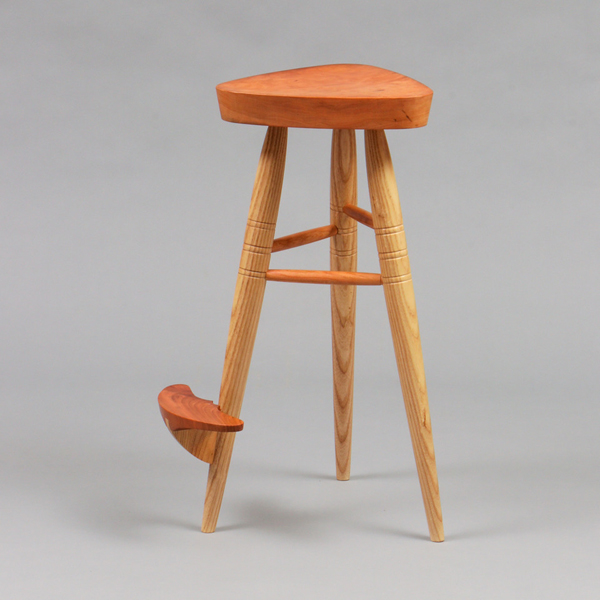
Locate an element on the screen. foot rest left is located at coordinates (300, 239).